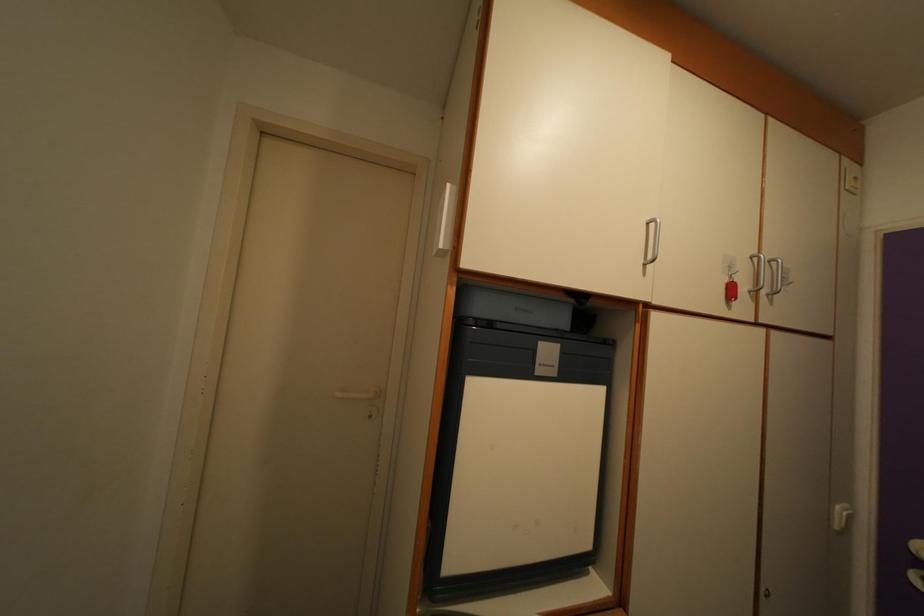
Find where to lift the red key tag. Please return your answer as a coordinate pair (x, y).

(731, 289)